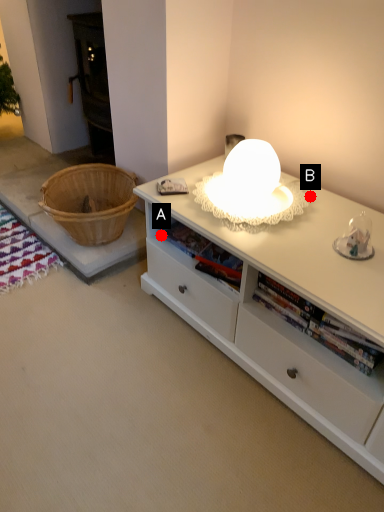
Question: Two points are circled on the image, labeled by A and B beside each circle. Among these points, which one is farthest from the camera?

Choices:
 (A) A is further
 (B) B is further

Answer: (A)